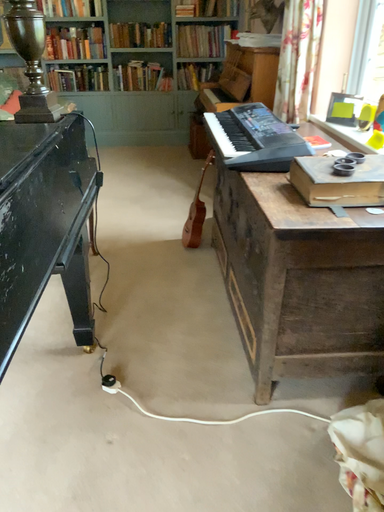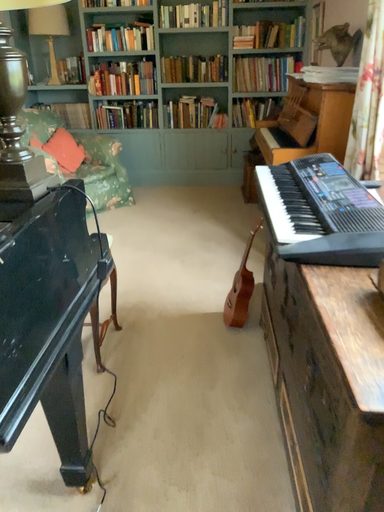
Question: How did the camera likely rotate when shooting the video?

Choices:
 (A) rotated right
 (B) rotated left

Answer: (B)